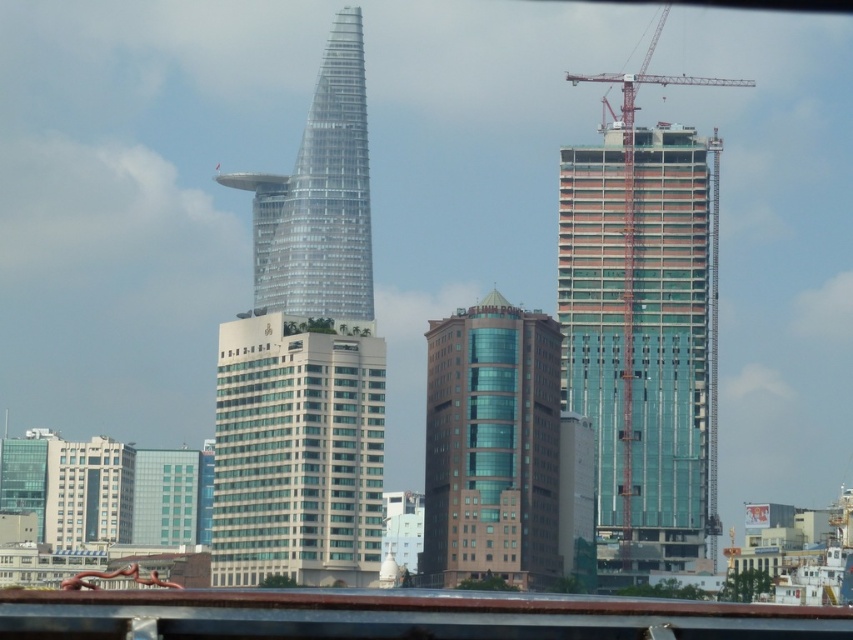
You are standing at the point marked by the coordinate point at (x=297, y=451) in the cityscape. Looking around, you see the white glass building at center. Which direction should you face to have the white glass building at center directly in front of you?

The point at (x=297, y=451) corresponds to the white glass building at center, so facing forward from that point would have the white glass building at center directly in front of you.

You are a city planner analyzing the cityscape. Given the white glass building at center and the metallic construction crane at right, which one takes up more area in the image?

The metallic construction crane at right occupies more space than the white glass building at center, so the crane takes up more area in the image.